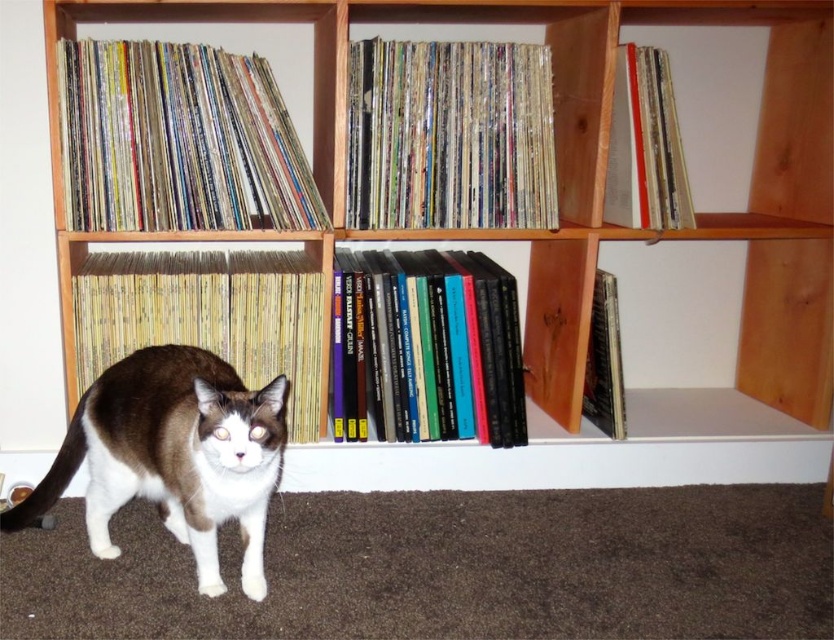
Who is positioned more to the right, multicolored vinyl records at center or brown and white fur cat at center?

From the viewer's perspective, multicolored vinyl records at center appears more on the right side.

Which is behind, point (425, 132) or point (141, 364)?

Positioned behind is point (425, 132).

Locate an element on the screen. This screenshot has height=640, width=834. multicolored vinyl records at center is located at coordinates (450, 134).

Is multicolored paper records at upper left shorter than hardcover books at center?

Indeed, multicolored paper records at upper left has a lesser height compared to hardcover books at center.

Does multicolored paper records at upper left have a greater height compared to hardcover books at center?

No.

Describe the element at coordinates (178, 140) in the screenshot. I see `multicolored paper records at upper left` at that location.

The width and height of the screenshot is (834, 640). Find the location of `multicolored paper records at upper left`. multicolored paper records at upper left is located at coordinates (178, 140).

Is multicolored vinyl records at center above matte paper book at upper right?

No.

Is point (531, 125) less distant than point (636, 90)?

Yes, it is.

The height and width of the screenshot is (640, 834). In order to click on multicolored vinyl records at center in this screenshot , I will do `click(450, 134)`.